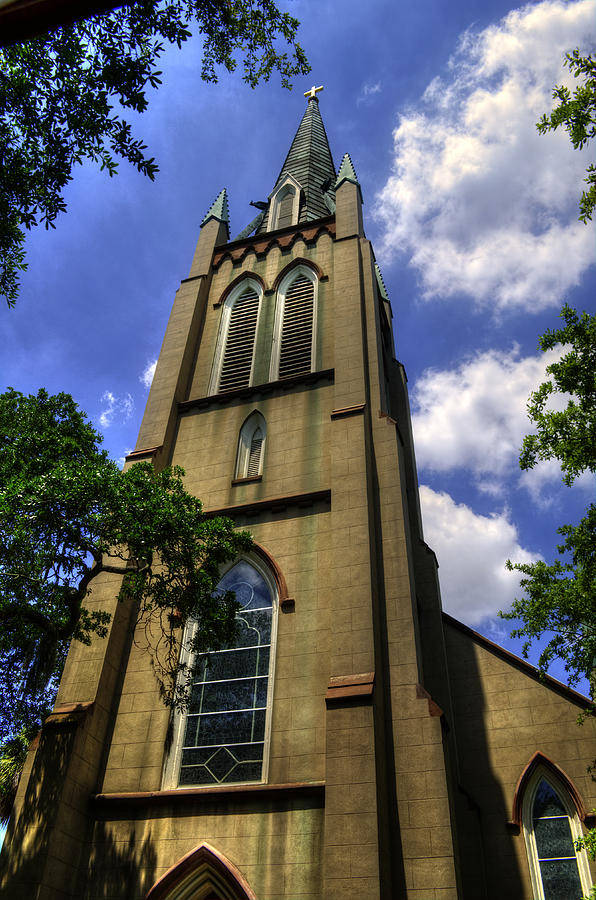
Where is `window headers`? Image resolution: width=596 pixels, height=900 pixels. window headers is located at coordinates (262, 549), (523, 774).